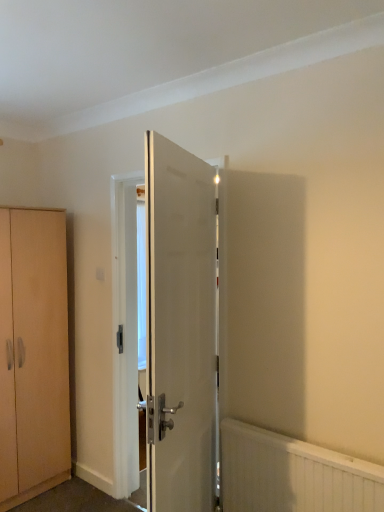
The width and height of the screenshot is (384, 512). I want to click on white textured radiator at lower right, so click(x=292, y=474).

Find the location of a particular element. This screenshot has height=512, width=384. light brown wood cabinet at left is located at coordinates (33, 354).

Considering the positions of objects light brown wood cabinet at left and white textured radiator at lower right in the image provided, who is behind, light brown wood cabinet at left or white textured radiator at lower right?

Positioned behind is light brown wood cabinet at left.

From the image's perspective, which one is positioned higher, light brown wood cabinet at left or white textured radiator at lower right?

light brown wood cabinet at left.

Does light brown wood cabinet at left have a lesser height compared to white textured radiator at lower right?

Incorrect, the height of light brown wood cabinet at left does not fall short of that of white textured radiator at lower right.

Are light brown wood cabinet at left and white textured radiator at lower right far apart?

Absolutely, light brown wood cabinet at left is distant from white textured radiator at lower right.

In the scene shown: Is white glossy door at center positioned in front of light brown wood cabinet at left?

Yes, the depth of white glossy door at center is less than that of light brown wood cabinet at left.

From a real-world perspective, is white glossy door at center over light brown wood cabinet at left?

Indeed, from a real-world perspective, white glossy door at center stands above light brown wood cabinet at left.

Which object is wider, white glossy door at center or light brown wood cabinet at left?

With larger width is light brown wood cabinet at left.

Is white textured radiator at lower right at the left side of light brown wood cabinet at left?

In fact, white textured radiator at lower right is to the right of light brown wood cabinet at left.

Is white textured radiator at lower right facing away from light brown wood cabinet at left?

That's not correct — white textured radiator at lower right is not looking away from light brown wood cabinet at left.

Can you confirm if white textured radiator at lower right is taller than light brown wood cabinet at left?

No.

From the image's perspective, which object appears higher, white glossy door at center or white textured radiator at lower right?

white glossy door at center appears higher in the image.

Does point (152, 162) come closer to viewer compared to point (286, 475)?

Yes, point (152, 162) is in front of point (286, 475).

Who is taller, white glossy door at center or white textured radiator at lower right?

white glossy door at center.

Which is more to the left, light brown wood cabinet at left or white glossy door at center?

light brown wood cabinet at left is more to the left.

From the image's perspective, is light brown wood cabinet at left over white glossy door at center?

Actually, light brown wood cabinet at left appears below white glossy door at center in the image.

Is light brown wood cabinet at left facing towards white glossy door at center?

Yes, light brown wood cabinet at left is aimed at white glossy door at center.

Between light brown wood cabinet at left and white glossy door at center, which one has more height?

With more height is light brown wood cabinet at left.

Is white glossy door at center located within white textured radiator at lower right?

No, white glossy door at center is not a part of white textured radiator at lower right.

Can you confirm if white textured radiator at lower right is shorter than white glossy door at center?

Yes, white textured radiator at lower right is shorter than white glossy door at center.

Is white textured radiator at lower right facing away from white glossy door at center?

No, white glossy door at center is not at the back of white textured radiator at lower right.

Find the location of a particular element. radiator below the light brown wood cabinet at left (from a real-world perspective) is located at coordinates (292, 474).

Find the location of a particular element. The height and width of the screenshot is (512, 384). door above the light brown wood cabinet at left (from the image's perspective) is located at coordinates (180, 328).

Estimate the real-world distances between objects in this image. Which object is further from white textured radiator at lower right, light brown wood cabinet at left or white glossy door at center?

The object further to white textured radiator at lower right is light brown wood cabinet at left.

Based on their spatial positions, is white textured radiator at lower right or white glossy door at center further from light brown wood cabinet at left?

Among the two, white textured radiator at lower right is located further to light brown wood cabinet at left.

From the image, which object appears to be farther from white glossy door at center, light brown wood cabinet at left or white textured radiator at lower right?

The object further to white glossy door at center is light brown wood cabinet at left.

Considering their positions, is white textured radiator at lower right positioned further to white glossy door at center than light brown wood cabinet at left?

light brown wood cabinet at left is positioned further to the anchor white glossy door at center.

Estimate the real-world distances between objects in this image. Which object is further from light brown wood cabinet at left, white glossy door at center or white textured radiator at lower right?

white textured radiator at lower right is further to light brown wood cabinet at left.

Based on their spatial positions, is white glossy door at center or light brown wood cabinet at left closer to white textured radiator at lower right?

Among the two, white glossy door at center is located nearer to white textured radiator at lower right.

Locate an element on the screen. door between light brown wood cabinet at left and white textured radiator at lower right in the horizontal direction is located at coordinates (180, 328).